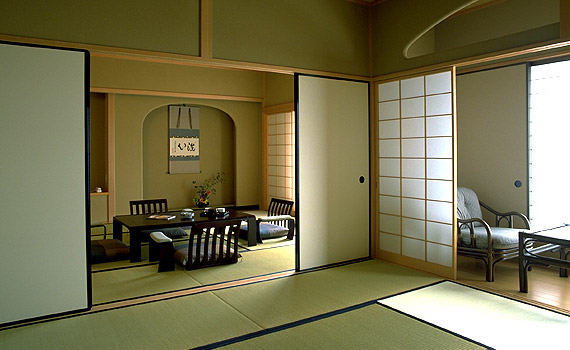
At what (x,y) coordinates should I click in order to perform the action: click on green carpet. Please return your answer as a coordinate pair (x, y). The width and height of the screenshot is (570, 350). Looking at the image, I should click on (325, 290), (137, 343), (329, 331), (157, 280), (247, 270), (109, 229), (272, 241).